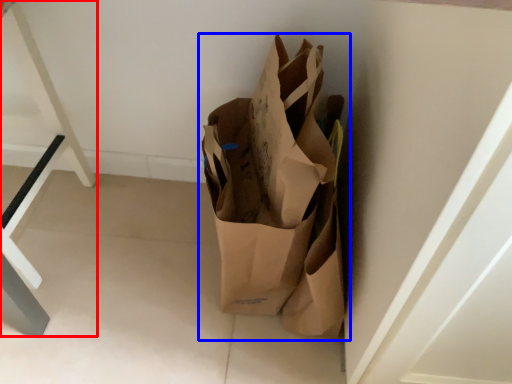
Question: Among these objects, which one is nearest to the camera, furniture (highlighted by a red box) or grocery bag (highlighted by a blue box)?

Choices:
 (A) furniture
 (B) grocery bag

Answer: (B)